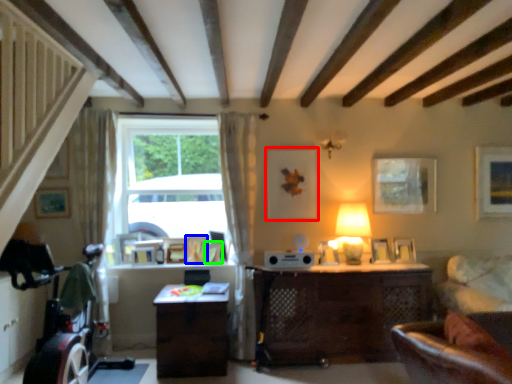
Question: Which is nearer to the picture frame (highlighted by a red box)? picture frame (highlighted by a blue box) or picture frame (highlighted by a green box).

Choices:
 (A) picture frame
 (B) picture frame

Answer: (B)